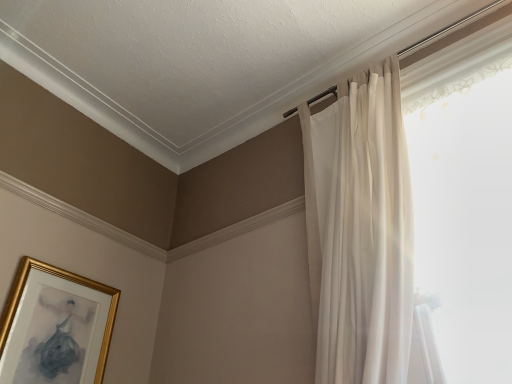
Question: Considering the positions of gold-framed picture at lower left and sheer white curtain at upper right in the image, is gold-framed picture at lower left wider or thinner than sheer white curtain at upper right?

Choices:
 (A) wide
 (B) thin

Answer: (B)

Question: Based on their positions, is gold-framed picture at lower left located to the left or right of sheer white curtain at upper right?

Choices:
 (A) right
 (B) left

Answer: (B)

Question: From a real-world perspective, is gold-framed picture at lower left positioned above or below sheer white curtain at upper right?

Choices:
 (A) above
 (B) below

Answer: (B)

Question: Would you say sheer white curtain at upper right is to the left or to the right of gold-framed picture at lower left in the picture?

Choices:
 (A) right
 (B) left

Answer: (A)

Question: From a real-world perspective, is sheer white curtain at upper right above or below gold-framed picture at lower left?

Choices:
 (A) above
 (B) below

Answer: (A)

Question: Choose the correct answer: Is sheer white curtain at upper right inside gold-framed picture at lower left or outside it?

Choices:
 (A) inside
 (B) outside

Answer: (B)

Question: Is point (408, 314) positioned closer to the camera than point (24, 332)?

Choices:
 (A) closer
 (B) farther

Answer: (A)